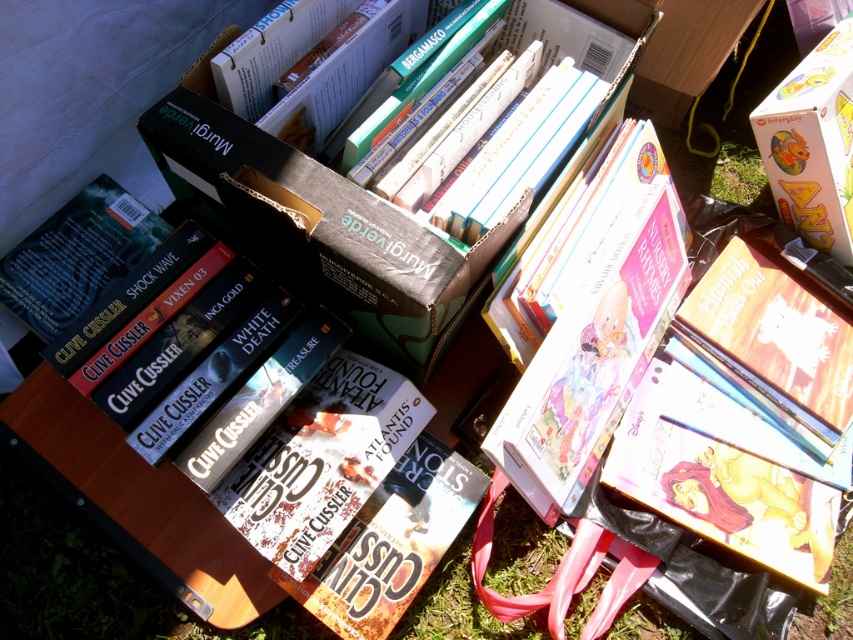
Question: Which of the following is the closest to the observer?

Choices:
 (A) yellow cardboard box at upper right
 (B) green grass at lower right
 (C) hardcover book at center

Answer: (C)

Question: Is hardcover book at center to the right of yellow cardboard box at upper right from the viewer's perspective?

Choices:
 (A) yes
 (B) no

Answer: (B)

Question: Which point is closer to the camera?

Choices:
 (A) (734, 189)
 (B) (4, 612)
 (C) (799, 173)

Answer: (B)

Question: Which point appears farthest from the camera in this image?

Choices:
 (A) (759, 168)
 (B) (779, 152)

Answer: (A)

Question: Does hardcover book at center have a smaller size compared to yellow cardboard box at upper right?

Choices:
 (A) yes
 (B) no

Answer: (B)

Question: Is hardcover book at center further to camera compared to green grass at lower right?

Choices:
 (A) yes
 (B) no

Answer: (B)